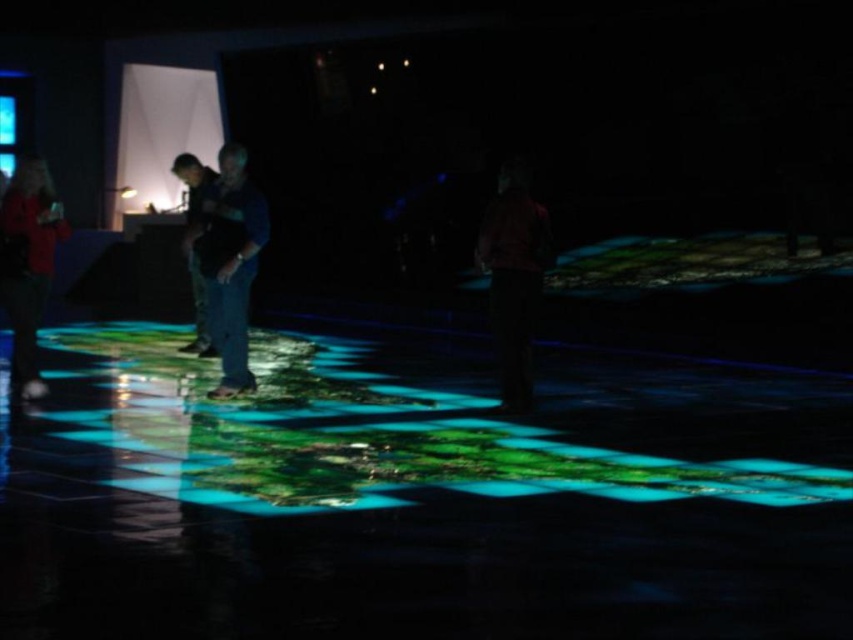
Question: From the image, what is the correct spatial relationship of dark blue jeans at center in relation to dark red shirt at center?

Choices:
 (A) below
 (B) above

Answer: (B)

Question: Is dark red shirt at center positioned before matte red shirt at left?

Choices:
 (A) yes
 (B) no

Answer: (B)

Question: Is dark blue jeans at center wider than matte red shirt at left?

Choices:
 (A) yes
 (B) no

Answer: (A)

Question: Which point is farther from the camera taking this photo?

Choices:
 (A) (521, 180)
 (B) (201, 212)
 (C) (32, 294)

Answer: (B)

Question: Which of the following is the farthest from the observer?

Choices:
 (A) dark red shirt at center
 (B) dark blue jeans at center

Answer: (B)

Question: Among these objects, which one is nearest to the camera?

Choices:
 (A) dark blue jeans at center
 (B) dark red shirt at center
 (C) matte red shirt at left

Answer: (C)